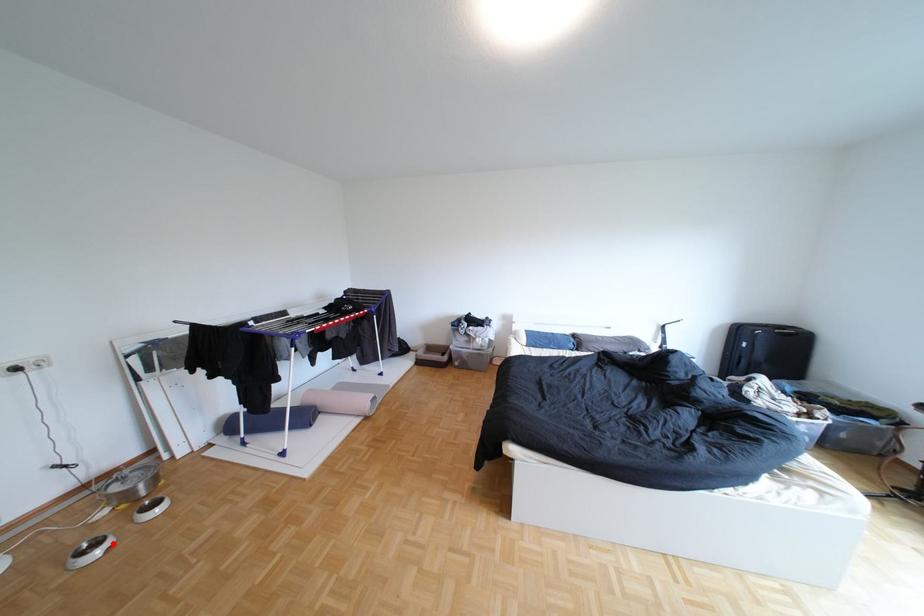
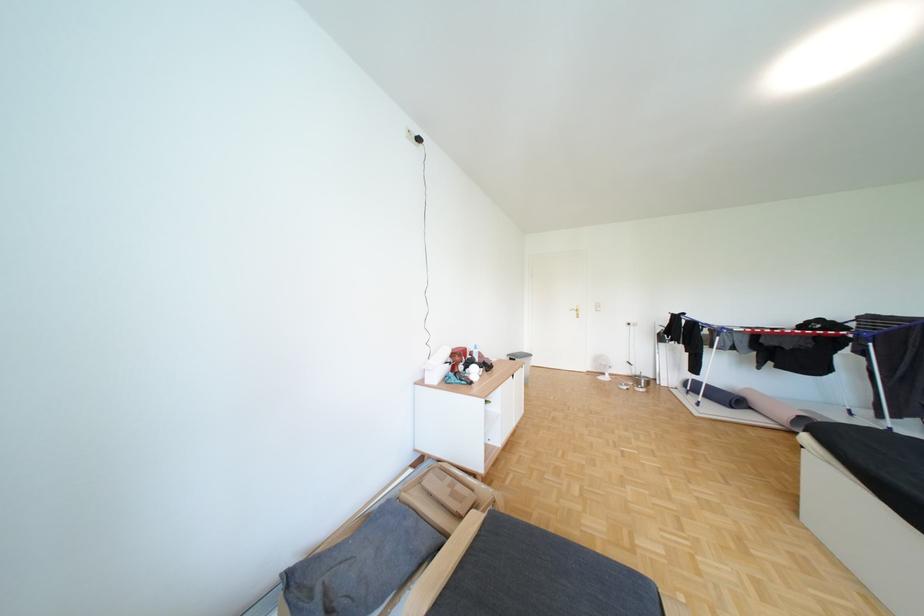
Question: I am providing you with two images of the same scene from different viewpoints. A red point is marked on the first image. Is the red point's position out of view in image 2?

Choices:
 (A) Yes
 (B) No

Answer: (A)